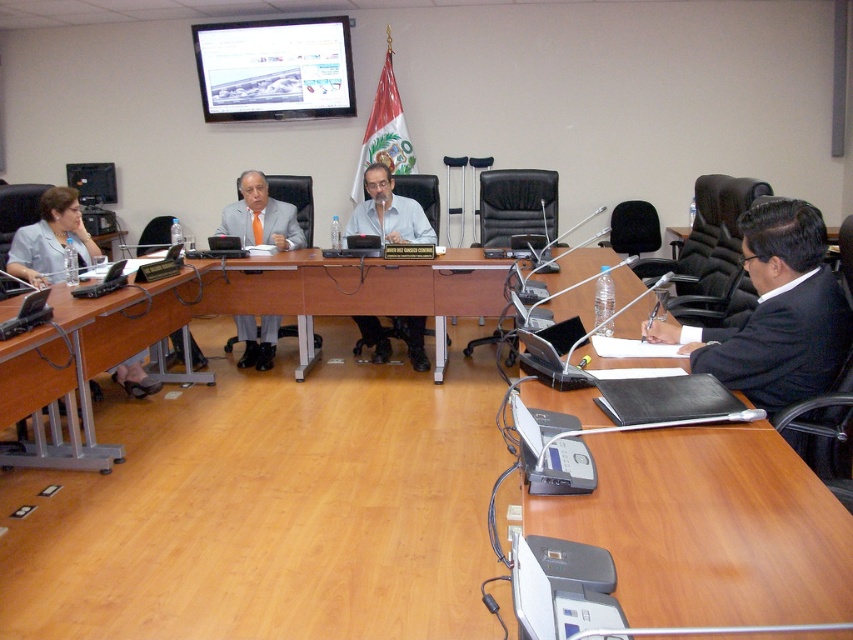
Does point (74, 188) come farther from viewer compared to point (114, 198)?

No, (74, 188) is in front of (114, 198).

Find the location of a particular element. Image resolution: width=853 pixels, height=640 pixels. matte gray suit at left is located at coordinates (51, 240).

Which is more to the right, brown wooden table at lower left or matte black laptop at left?

brown wooden table at lower left is more to the right.

The image size is (853, 640). I want to click on brown wooden table at lower left, so click(x=86, y=365).

Does matte gray suit at center appear over matte black laptop at left?

No, matte gray suit at center is not above matte black laptop at left.

Is matte gray suit at center positioned in front of matte black laptop at left?

Yes, matte gray suit at center is in front of matte black laptop at left.

Which is behind, point (231, 212) or point (86, 198)?

The point (86, 198) is more distant.

The image size is (853, 640). Identify the location of matte gray suit at center. (260, 216).